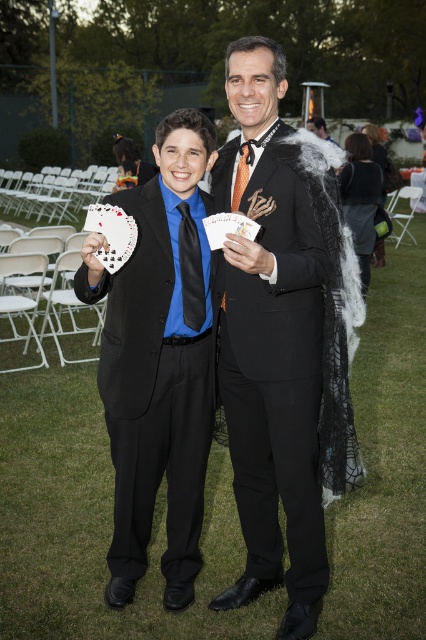
Question: Does matte black suit at center appear over black fabric coat at center?

Choices:
 (A) no
 (B) yes

Answer: (A)

Question: Which object is closer to the camera taking this photo?

Choices:
 (A) orange satin tie at center
 (B) black fabric coat at center

Answer: (A)

Question: Which point appears farthest from the camera in this image?

Choices:
 (A) (123, 432)
 (B) (267, 252)
 (C) (310, 509)
 (D) (382, 256)

Answer: (D)

Question: Can you confirm if black satin suit at center is smaller than matte black suit at center?

Choices:
 (A) yes
 (B) no

Answer: (B)

Question: Which of the following is the farthest from the observer?

Choices:
 (A) (236, 252)
 (B) (183, 218)
 (C) (242, 186)

Answer: (B)

Question: Can you confirm if white matte hand at center is smaller than orange satin tie at center?

Choices:
 (A) yes
 (B) no

Answer: (B)